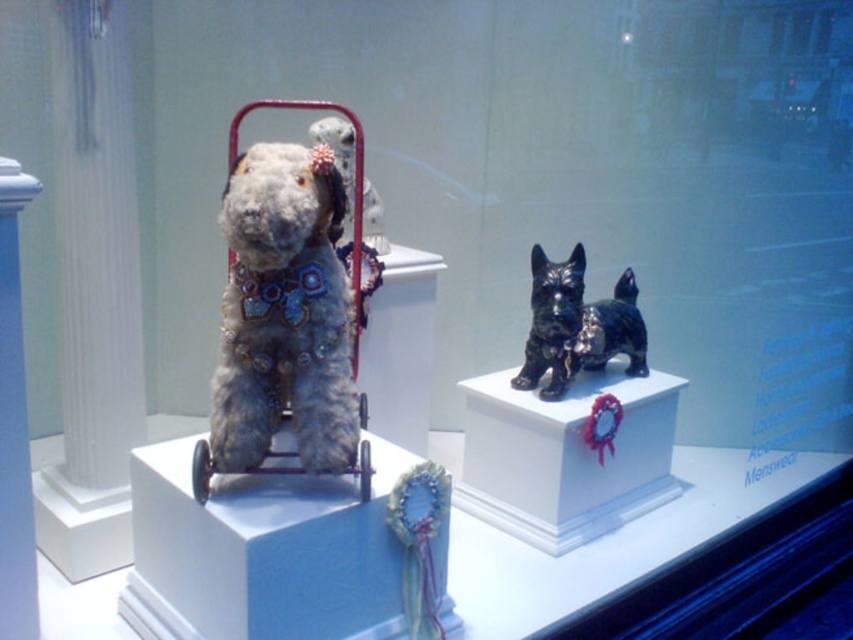
Question: Observing the image, what is the correct spatial positioning of shiny black figurine at center in reference to shiny blue ribbon at center?

Choices:
 (A) above
 (B) below

Answer: (A)

Question: Which object is the farthest from the shiny black figurine at center?

Choices:
 (A) shiny blue ribbon at center
 (B) fuzzy fabric dog stroller at upper center
 (C) fuzzy fabric dog at center

Answer: (C)

Question: Which is farther from the fuzzy fabric dog at center?

Choices:
 (A) fuzzy fabric dog stroller at upper center
 (B) shiny blue ribbon at center
 (C) shiny black figurine at center

Answer: (C)

Question: Is fuzzy fabric dog at center below shiny black figurine at center?

Choices:
 (A) no
 (B) yes

Answer: (A)

Question: Which object appears farthest from the camera in this image?

Choices:
 (A) shiny blue ribbon at center
 (B) fuzzy fabric dog at center
 (C) shiny black figurine at center
 (D) fuzzy fabric dog stroller at upper center

Answer: (C)

Question: Is fuzzy fabric dog at center below shiny blue ribbon at center?

Choices:
 (A) yes
 (B) no

Answer: (B)